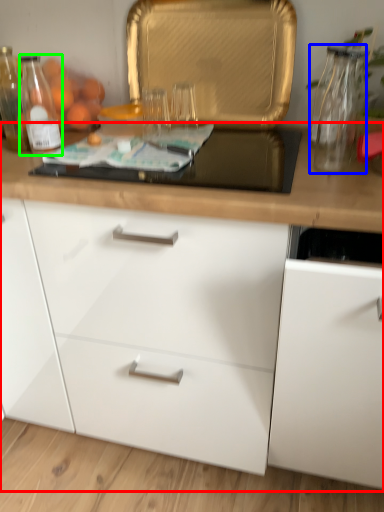
Question: Considering the real-world distances, which object is farthest from cabinetry (highlighted by a red box)? glass vase (highlighted by a blue box) or bottle (highlighted by a green box)?

Choices:
 (A) glass vase
 (B) bottle

Answer: (B)